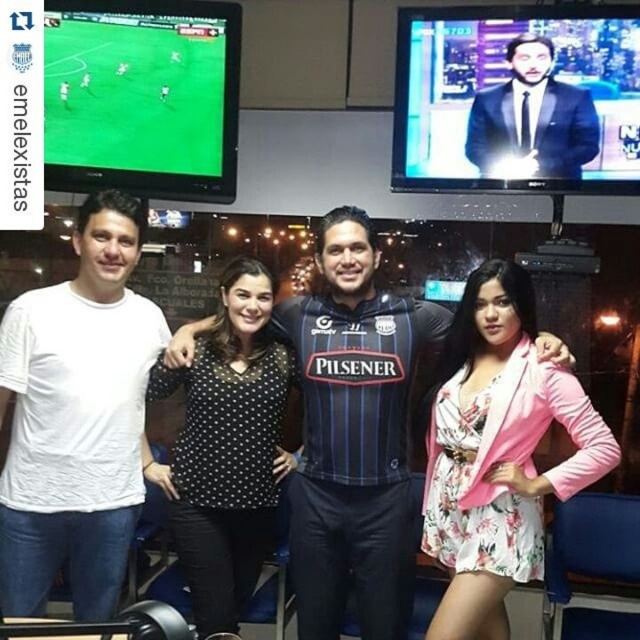
In the image, there are four people dressed in different clothing items. The first person is wearing a white cotton t shirt at left, the second a black polka dot top, the third a dark Pilsener sports jersey over a black shirt, and the fourth in a... Can you determine which clothing item is located at the coordinate point (x=76, y=419)?

The white cotton t shirt at left is located at coordinate point (x=76, y=419).

In the scene shown: You are standing at the origin point in the image. Where is the blue striped jersey at center located in terms of coordinates?

The blue striped jersey at center is located at coordinates point (353, 433).

You are a photographer trying to capture a group photo of the blue striped jersey at center and the floral fabric romper at center. You need to ensure there is at least 1 foot of space between them for the camera to focus properly. Based on the scene description, will there be enough space between the two subjects?

The blue striped jersey at center is 12.48 inches from the floral fabric romper at center. Since 12.48 inches is equal to 1.04 feet, which is just over the required 1 foot of space, there is enough room for the camera to focus properly.